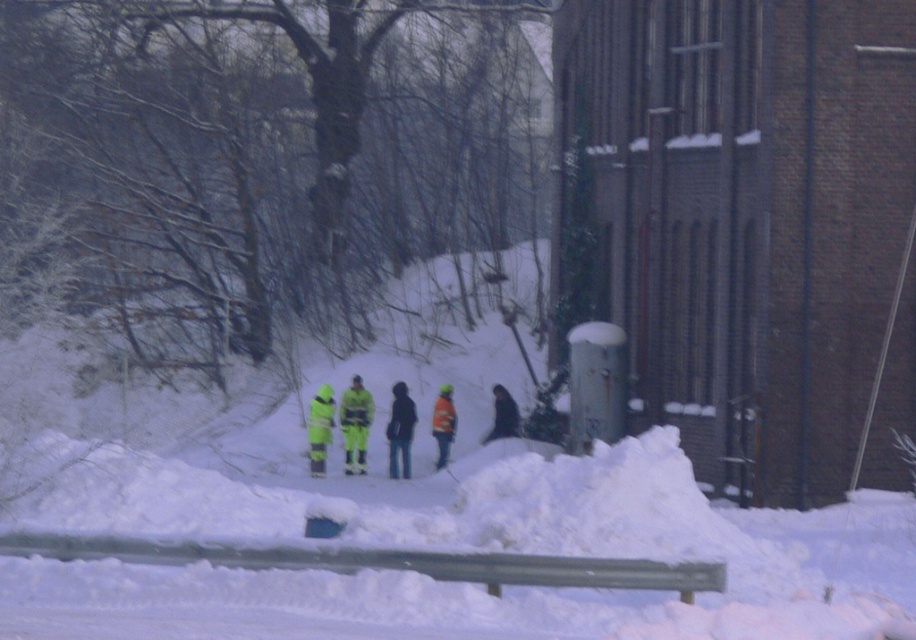
Who is taller, dark blue jeans at center or orange reflective jacket at center?

dark blue jeans at center

How far apart are dark blue jeans at center and orange reflective jacket at center?

The distance of dark blue jeans at center from orange reflective jacket at center is 79.86 centimeters.

Where is `dark blue jeans at center`? This screenshot has height=640, width=916. dark blue jeans at center is located at coordinates (400, 429).

Which is above, dark blue jeans at center or high-visibility reflective jacket at center?

dark blue jeans at center

Who is lower down, dark blue jeans at center or high-visibility reflective jacket at center?

high-visibility reflective jacket at center is lower down.

Is point (404, 456) farther from camera compared to point (311, 445)?

No, it is not.

At what (x,y) coordinates should I click in order to perform the action: click on dark blue jeans at center. Please return your answer as a coordinate pair (x, y). The image size is (916, 640). Looking at the image, I should click on (400, 429).

Does point (351, 442) lie behind point (397, 476)?

Yes, it is.

Who is higher up, neon yellow reflective jacket at center or dark blue jeans at center?

dark blue jeans at center

Is point (354, 426) behind point (401, 392)?

That is False.

You are a GUI agent. You are given a task and a screenshot of the screen. Output one action in this format:
    pyautogui.click(x=<x>, y=<y>)
    Task: Click on the neon yellow reflective jacket at center
    Image resolution: width=916 pixels, height=640 pixels.
    Given the screenshot: What is the action you would take?
    pyautogui.click(x=355, y=424)